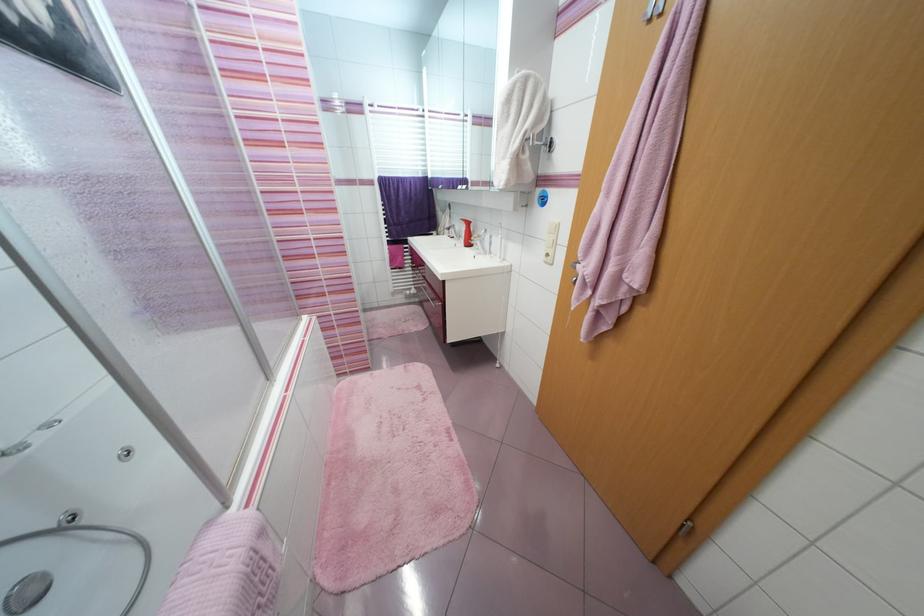
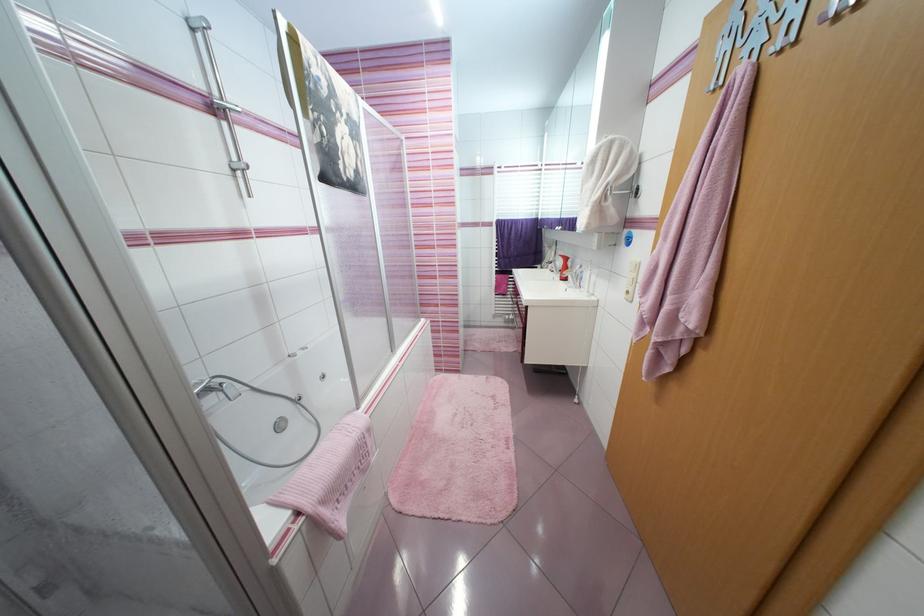
The point at [432,167] is marked in the first image. Where is the corresponding point in the second image?

(543, 211)